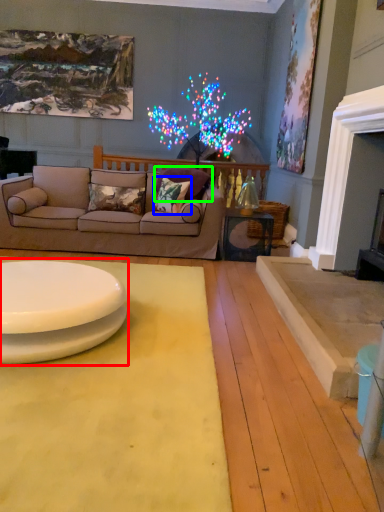
Question: Which is nearer to the table (highlighted by a red box)? pillow (highlighted by a blue box) or pillow (highlighted by a green box).

Choices:
 (A) pillow
 (B) pillow

Answer: (A)